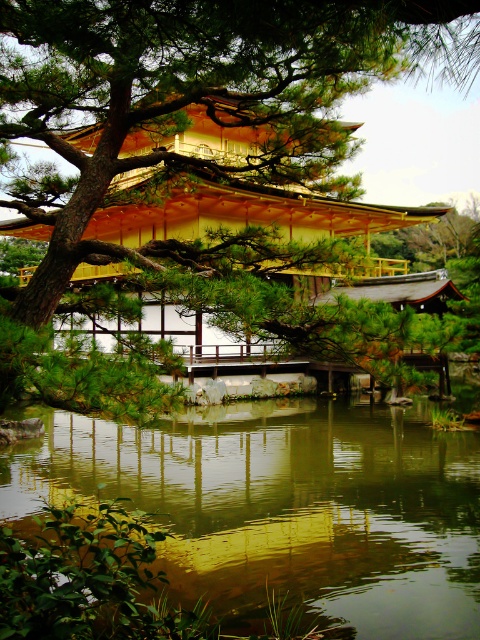
You are standing in front of the Golden Pavilion and notice two points in the scene. The first point is at coordinates point(51,60) and the second is at point(257,493). Which of these points is nearer to you?

Point(51,60) is closer to the viewer than point(257,493).

You are an artist planning to paint the scene of the golden pavilion. You have two brushes, one thin and one thick. Which brush should you use for the green textured pine tree at upper left and which for the green reflective water at center?

The green textured pine tree at upper left is thinner, so use the thin brush for it. The green reflective water at center is wider, so use the thick brush for it.